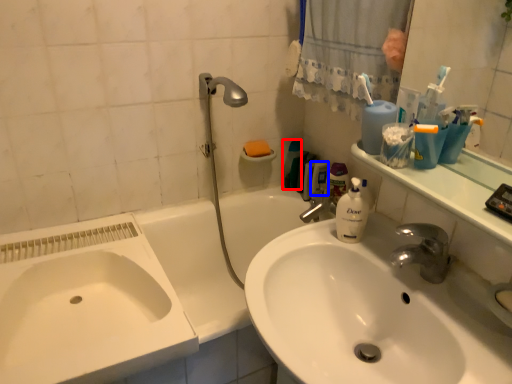
Question: Which point is further to the camera, cleaning product (highlighted by a red box) or mouthwash (highlighted by a blue box)?

Choices:
 (A) cleaning product
 (B) mouthwash

Answer: (A)